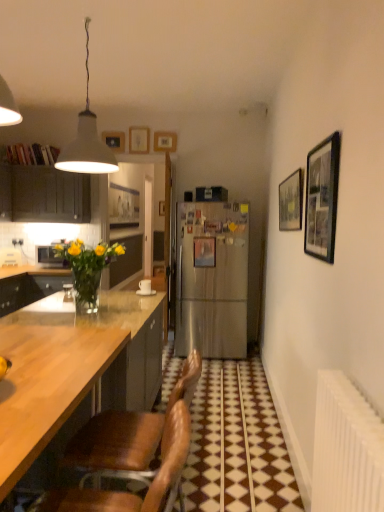
Question: From a real-world perspective, is matte dark wood cabinet at left beneath black matte picture frame at upper right, marked as the 2th picture frame in a right-to-left arrangement?

Choices:
 (A) yes
 (B) no

Answer: (B)

Question: Can you see matte dark wood cabinet at left touching black matte picture frame at upper right, the 1th picture frame viewed from the front?

Choices:
 (A) no
 (B) yes

Answer: (A)

Question: Can you confirm if matte dark wood cabinet at left is positioned to the right of black matte picture frame at upper right, marked as the 2th picture frame in a right-to-left arrangement?

Choices:
 (A) no
 (B) yes

Answer: (A)

Question: Are matte dark wood cabinet at left and black matte picture frame at upper right, placed as the 6th picture frame when sorted from back to front, located far from each other?

Choices:
 (A) no
 (B) yes

Answer: (B)

Question: Is matte dark wood cabinet at left bigger than black matte picture frame at upper right, placed as the 6th picture frame when sorted from back to front?

Choices:
 (A) yes
 (B) no

Answer: (A)

Question: In terms of height, does wooden picture frame at upper right, placed as the 6th picture frame when sorted from left to right, look taller or shorter compared to matte dark wood cabinet at left?

Choices:
 (A) tall
 (B) short

Answer: (B)

Question: Which is correct: wooden picture frame at upper right, placed as the 6th picture frame when sorted from left to right, is inside matte dark wood cabinet at left, or outside of it?

Choices:
 (A) outside
 (B) inside

Answer: (A)

Question: From the image's perspective, is wooden picture frame at upper right, which ranks as the 2th picture frame in front-to-back order, positioned above or below matte dark wood cabinet at left?

Choices:
 (A) above
 (B) below

Answer: (B)

Question: From a real-world perspective, is wooden picture frame at upper right, placed as the 6th picture frame when sorted from left to right, positioned above or below matte dark wood cabinet at left?

Choices:
 (A) above
 (B) below

Answer: (B)

Question: Is wooden picture frame at upper center, which is the fourth picture frame from right to left, spatially inside wooden picture frame at upper right, placed as the 6th picture frame when sorted from left to right, or outside of it?

Choices:
 (A) inside
 (B) outside

Answer: (B)

Question: From the image's perspective, is wooden picture frame at upper center, placed as the 4th picture frame when sorted from front to back, positioned above or below wooden picture frame at upper right, placed as the 6th picture frame when sorted from left to right?

Choices:
 (A) below
 (B) above

Answer: (B)

Question: In terms of size, does wooden picture frame at upper center, placed as the 4th picture frame when sorted from front to back, appear bigger or smaller than wooden picture frame at upper right, the 1th picture frame positioned from the right?

Choices:
 (A) big
 (B) small

Answer: (B)

Question: Is wooden picture frame at upper center, the third picture frame when ordered from left to right, taller or shorter than wooden picture frame at upper right, the 1th picture frame positioned from the right?

Choices:
 (A) short
 (B) tall

Answer: (A)

Question: Based on their positions, is brown leather chair at lower left, marked as the first chair in a back-to-front arrangement, located to the left or right of matte dark wood cabinet at left?

Choices:
 (A) left
 (B) right

Answer: (B)

Question: Is point (135, 459) closer or farther from the camera than point (3, 188)?

Choices:
 (A) closer
 (B) farther

Answer: (A)